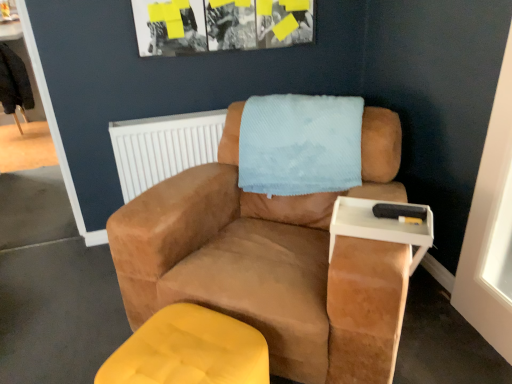
Question: Can you confirm if suede brown armchair at center is thinner than white plastic tray at right?

Choices:
 (A) yes
 (B) no

Answer: (B)

Question: From a real-world perspective, is suede brown armchair at center below white plastic tray at right?

Choices:
 (A) no
 (B) yes

Answer: (B)

Question: Is suede brown armchair at center further to the viewer compared to white plastic tray at right?

Choices:
 (A) no
 (B) yes

Answer: (A)

Question: From the image's perspective, is suede brown armchair at center below white plastic tray at right?

Choices:
 (A) yes
 (B) no

Answer: (B)

Question: Is suede brown armchair at center to the left of white plastic tray at right from the viewer's perspective?

Choices:
 (A) yes
 (B) no

Answer: (A)

Question: From the image's perspective, is suede brown armchair at center on white plastic tray at right?

Choices:
 (A) no
 (B) yes

Answer: (B)

Question: Is suede brown armchair at center shorter than matte yellow ottoman at lower left?

Choices:
 (A) yes
 (B) no

Answer: (B)

Question: From the image's perspective, does suede brown armchair at center appear higher than matte yellow ottoman at lower left?

Choices:
 (A) yes
 (B) no

Answer: (A)

Question: From a real-world perspective, is suede brown armchair at center on matte yellow ottoman at lower left?

Choices:
 (A) yes
 (B) no

Answer: (A)

Question: Does suede brown armchair at center turn towards matte yellow ottoman at lower left?

Choices:
 (A) yes
 (B) no

Answer: (A)

Question: From a real-world perspective, is suede brown armchair at center below matte yellow ottoman at lower left?

Choices:
 (A) no
 (B) yes

Answer: (A)

Question: Is suede brown armchair at center thinner than matte yellow ottoman at lower left?

Choices:
 (A) yes
 (B) no

Answer: (B)

Question: Can you confirm if matte yellow ottoman at lower left is positioned to the right of white plastic radiator at upper center?

Choices:
 (A) no
 (B) yes

Answer: (B)